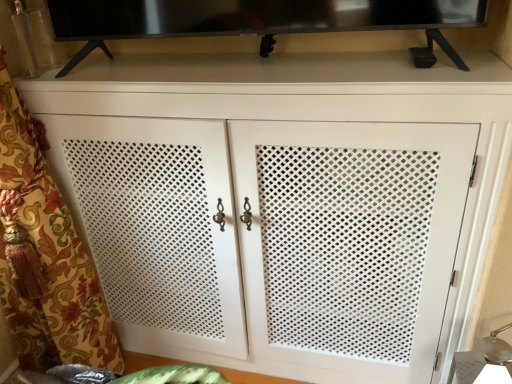
You are a GUI agent. You are given a task and a screenshot of the screen. Output one action in this format:
    pyautogui.click(x=<x>, y=<y>)
    Task: Click on the white textured lampshade at right
    
    Given the screenshot: What is the action you would take?
    pyautogui.click(x=480, y=357)

This screenshot has width=512, height=384. What do you see at coordinates (480, 357) in the screenshot? I see `white textured lampshade at right` at bounding box center [480, 357].

Measure the distance between point (469, 359) and camera.

They are 1.18 meters apart.

Identify the location of white textured lampshade at right. (480, 357).